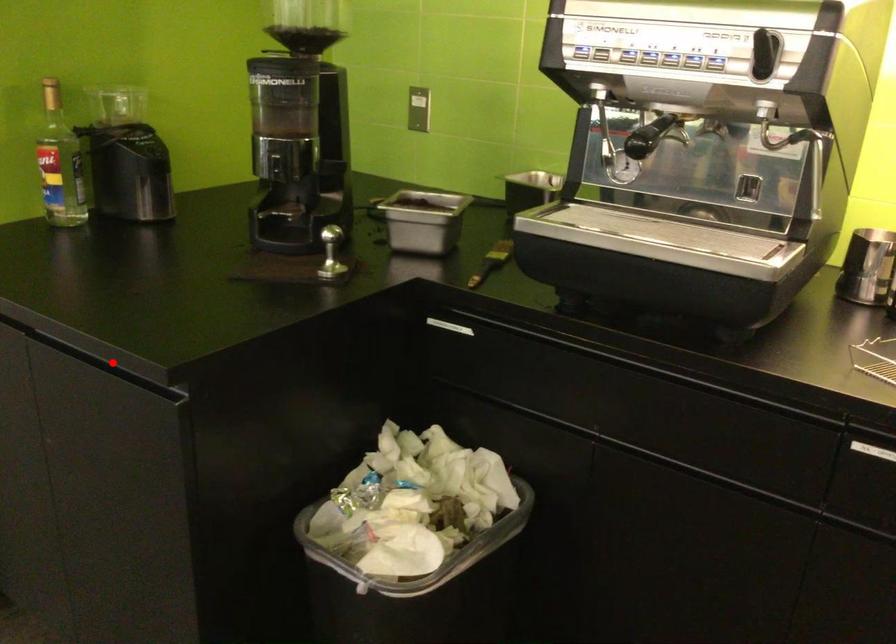
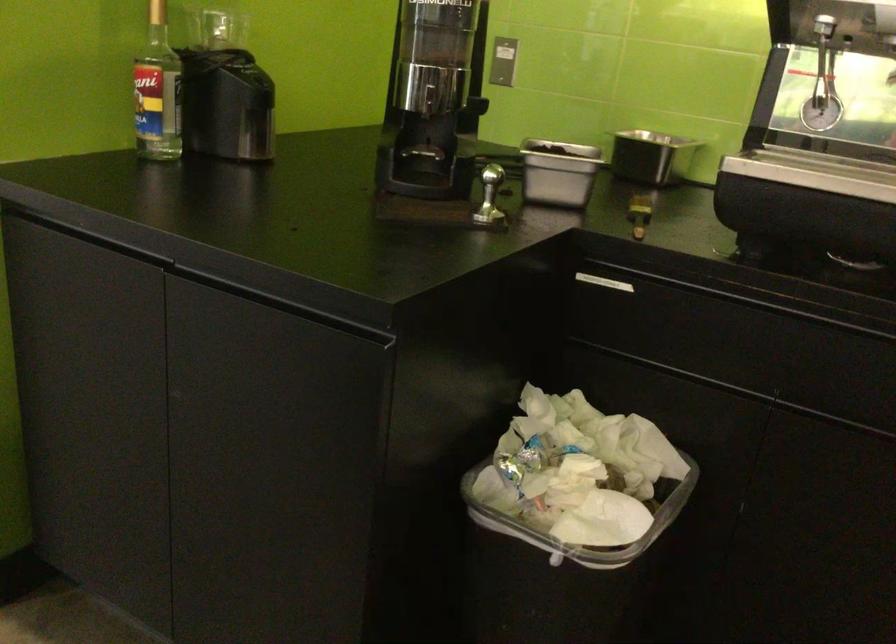
The point at the highlighted location is marked in the first image. Where is the corresponding point in the second image?

(280, 304)